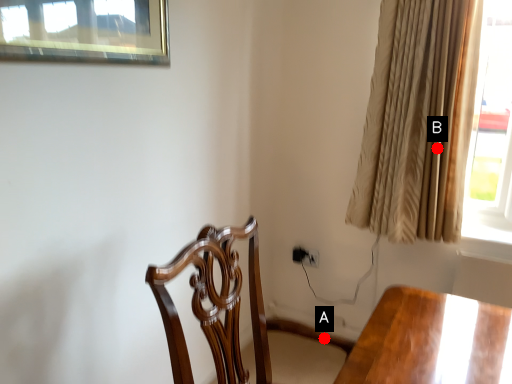
Question: Two points are circled on the image, labeled by A and B beside each circle. Which point is closer to the camera taking this photo?

Choices:
 (A) A is closer
 (B) B is closer

Answer: (B)